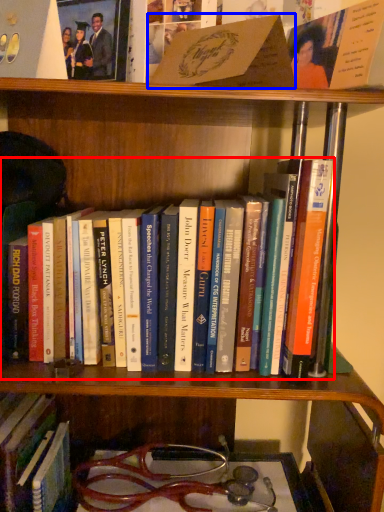
Question: Which point is further to the camera, book (highlighted by a red box) or book (highlighted by a blue box)?

Choices:
 (A) book
 (B) book

Answer: (A)